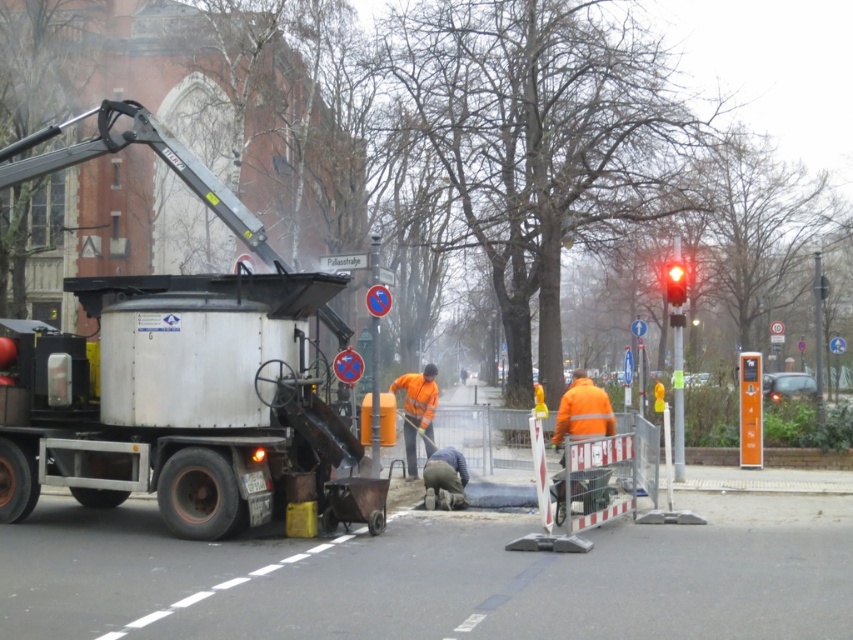
You are a pedestrian crossing the street and see the silver metallic truck at left and the red glass traffic light at upper right. Which object is closer to your left side?

The silver metallic truck at left is closer to your left side because it is positioned to the left of the red glass traffic light at upper right.

You are a pedestrian trying to cross the street. You see the silver metallic truck at left and the red glass traffic light at upper right. Which object is nearer to you?

The silver metallic truck at left is closer to the viewer than the red glass traffic light at upper right.

You are a delivery driver who needs to park your 15 feet long truck between the silver metallic truck at left and the red glass traffic light at upper right. Is there enough space between them to park your truck without overlapping either?

The distance between the silver metallic truck at left and the red glass traffic light at upper right is 20.33 feet. Since your truck is 15 feet long, there is sufficient space to park it between them without overlapping either object.